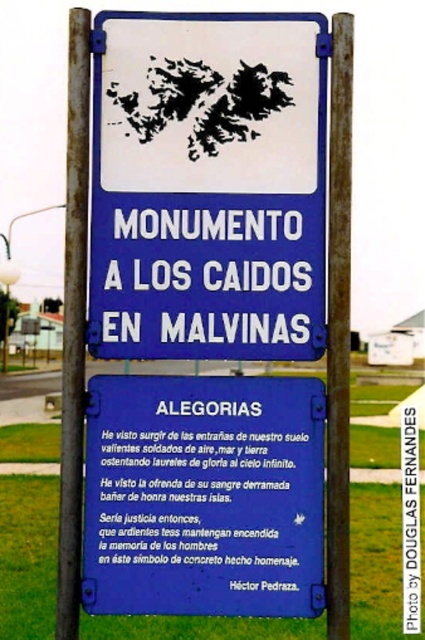
Can you confirm if blue painted metal sign at center is shorter than rusty metal pole at left?

Yes.

Who is positioned more to the right, blue painted metal sign at center or rusty metal pole at left?

From the viewer's perspective, blue painted metal sign at center appears more on the right side.

Looking at this image, who is more forward, (x=227, y=378) or (x=87, y=58)?

Positioned in front is point (x=87, y=58).

Where is `blue painted metal sign at center`? blue painted metal sign at center is located at coordinates (204, 496).

Between blue painted metal sign at center and rusty metal pole at center, which one appears on the left side from the viewer's perspective?

Positioned to the left is blue painted metal sign at center.

Locate an element on the screen. blue painted metal sign at center is located at coordinates (204, 496).

At what (x,y) coordinates should I click in order to perform the action: click on blue painted metal sign at center. Please return your answer as a coordinate pair (x, y). This screenshot has height=640, width=425. Looking at the image, I should click on (204, 496).

Locate an element on the screen. The width and height of the screenshot is (425, 640). blue painted metal sign at center is located at coordinates (204, 496).

Who is higher up, white plastic sign at center or rusty metal pole at center?

Positioned higher is white plastic sign at center.

Can you confirm if white plastic sign at center is bigger than rusty metal pole at center?

Yes.

Is point (144, 72) closer to viewer compared to point (331, 513)?

No, it is not.

I want to click on white plastic sign at center, so click(x=207, y=186).